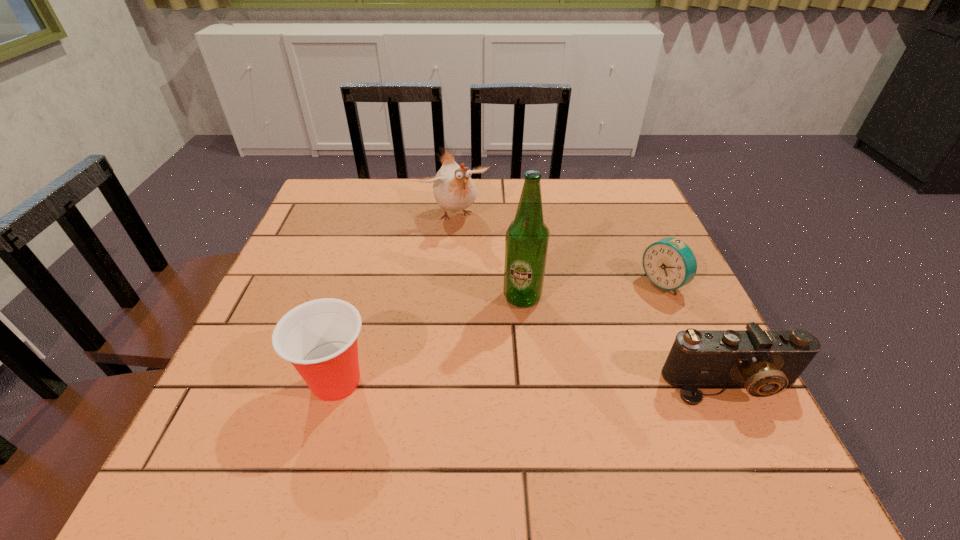
Locate an element on the screen. cup is located at coordinates (319, 337).

You are a GUI agent. You are given a task and a screenshot of the screen. Output one action in this format:
    pyautogui.click(x=<x>, y=<y>)
    Task: Click on the third tallest object
    The image size is (960, 540).
    Given the screenshot: What is the action you would take?
    pyautogui.click(x=319, y=337)

The image size is (960, 540). What are the coordinates of `camera` in the screenshot? It's located at (764, 361).

This screenshot has height=540, width=960. I want to click on the fourth shortest object, so click(x=454, y=190).

Identify the location of the farthest object. The height and width of the screenshot is (540, 960). (454, 190).

Locate an element on the screen. This screenshot has width=960, height=540. alarm clock is located at coordinates (669, 263).

At what (x,y) coordinates should I click in order to perform the action: click on beer bottle. Please return your answer as a coordinate pair (x, y). The height and width of the screenshot is (540, 960). Looking at the image, I should click on (527, 237).

This screenshot has height=540, width=960. I want to click on the tallest object, so click(527, 237).

Find the location of a particular element. The image size is (960, 540). free space located 0.130m on the left of the cup is located at coordinates (227, 382).

Find the location of a particular element. Image resolution: width=960 pixels, height=540 pixels. free space located 0.240m at the beak of the farthest object is located at coordinates (507, 291).